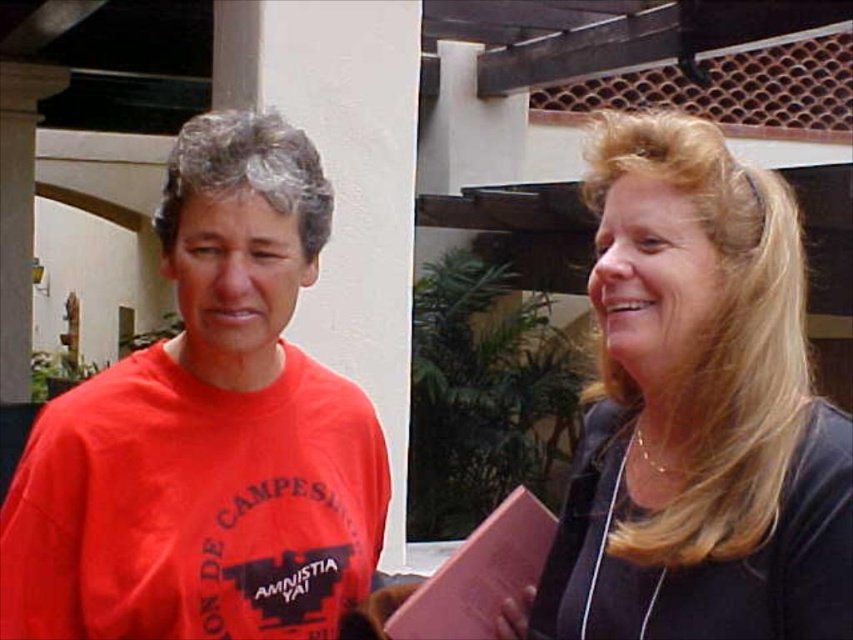
Question: Which of the following is the closest to the observer?

Choices:
 (A) matte red t-shirt at left
 (B) smooth black shirt at right

Answer: (B)

Question: Which point is closer to the camera?

Choices:
 (A) (717, 618)
 (B) (155, 422)

Answer: (A)

Question: Which point appears closest to the camera in this image?

Choices:
 (A) (650, 448)
 (B) (300, 486)

Answer: (A)

Question: Is matte red t-shirt at left closer to camera compared to smooth black shirt at right?

Choices:
 (A) yes
 (B) no

Answer: (B)

Question: Is matte red t-shirt at left in front of smooth black shirt at right?

Choices:
 (A) no
 (B) yes

Answer: (A)

Question: Does matte red t-shirt at left appear on the right side of smooth black shirt at right?

Choices:
 (A) yes
 (B) no

Answer: (B)